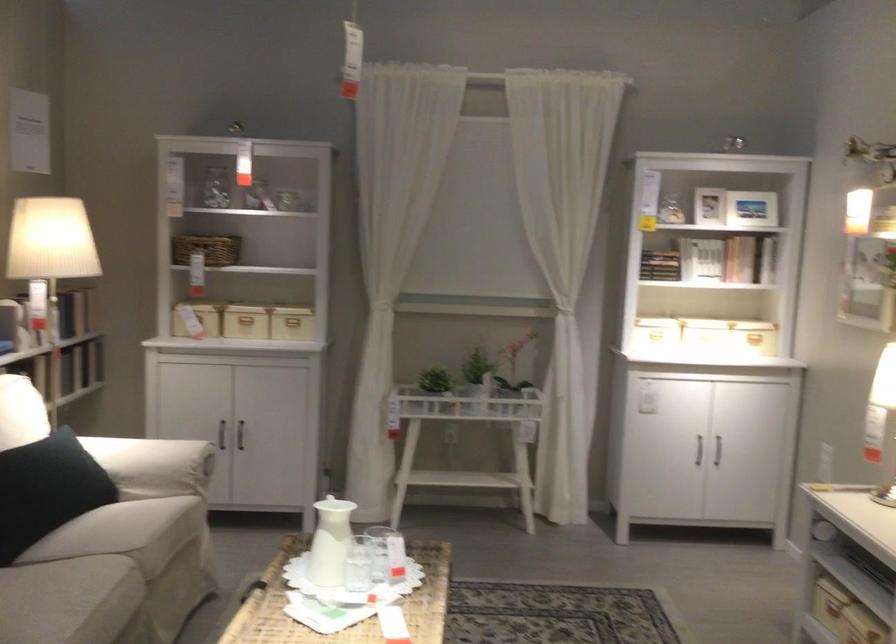
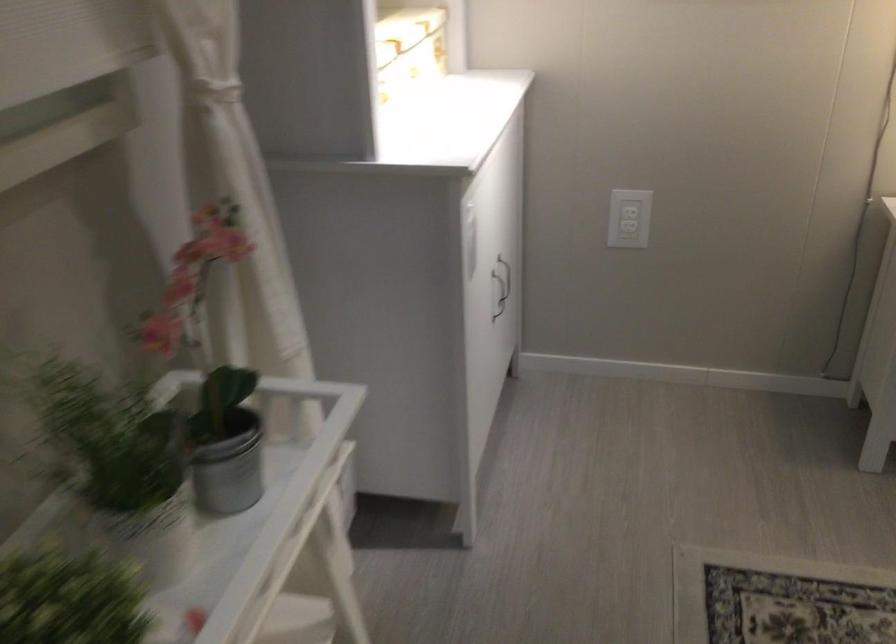
Question: I am providing you with two images of the same scene from different viewpoints. Please identify which objects are invisible in image2.

Choices:
 (A) metal plant pot
 (B) patterned storage box
 (C) dark cabinet handle
 (D) knife holder handle

Answer: (C)